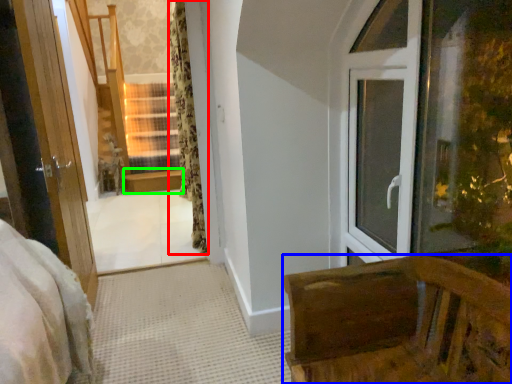
Question: Estimate the real-world distances between objects in this image. Which object is closer to curtain (highlighted by a red box), furniture (highlighted by a blue box) or window sill (highlighted by a green box)?

Choices:
 (A) furniture
 (B) window sill

Answer: (B)